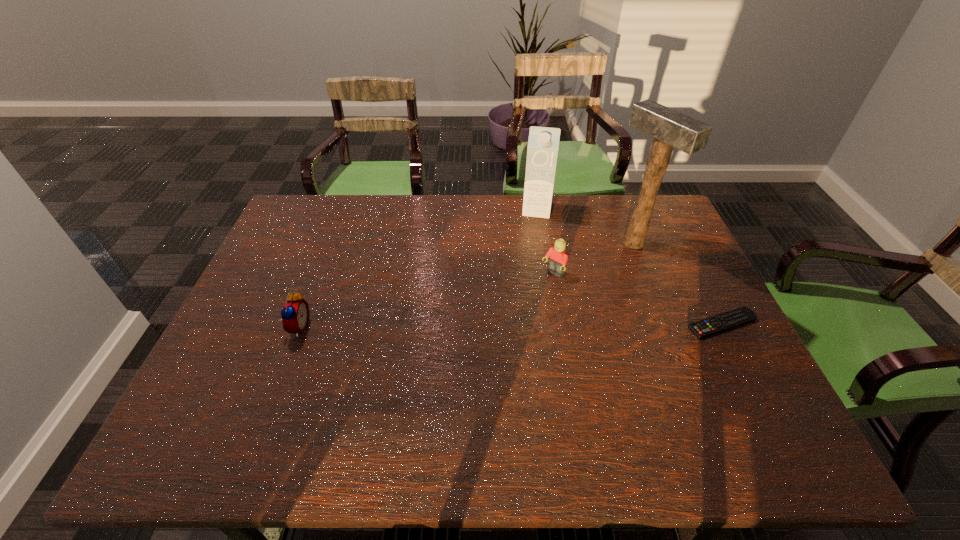
This screenshot has width=960, height=540. What are the coordinates of `the leftmost object` in the screenshot? It's located at (295, 315).

Find the location of a particular element. The width and height of the screenshot is (960, 540). the shortest object is located at coordinates (741, 316).

You are a GUI agent. You are given a task and a screenshot of the screen. Output one action in this format:
    pyautogui.click(x=<x>, y=<y>)
    Task: Click on the second tallest object
    The width and height of the screenshot is (960, 540).
    Given the screenshot: What is the action you would take?
    pyautogui.click(x=543, y=144)

Identify the location of carton. (543, 144).

You are a GUI agent. You are given a task and a screenshot of the screen. Output one action in this format:
    pyautogui.click(x=<x>, y=<y>)
    Task: Click on the fourth nearest object
    This screenshot has height=540, width=960.
    Given the screenshot: What is the action you would take?
    pyautogui.click(x=670, y=128)

Find the location of a particular element. mallet is located at coordinates tap(670, 128).

Find the location of a particular element. The width and height of the screenshot is (960, 540). the third farthest object is located at coordinates (558, 260).

Find the location of a particular element. This screenshot has width=960, height=540. free region located 0.260m on the front-facing side of the leftmost object is located at coordinates (408, 327).

Locate an element on the screen. blank space located on the left of the remote control is located at coordinates (644, 324).

Where is `free location located on the front label of the farthest object`? This screenshot has height=540, width=960. free location located on the front label of the farthest object is located at coordinates (526, 289).